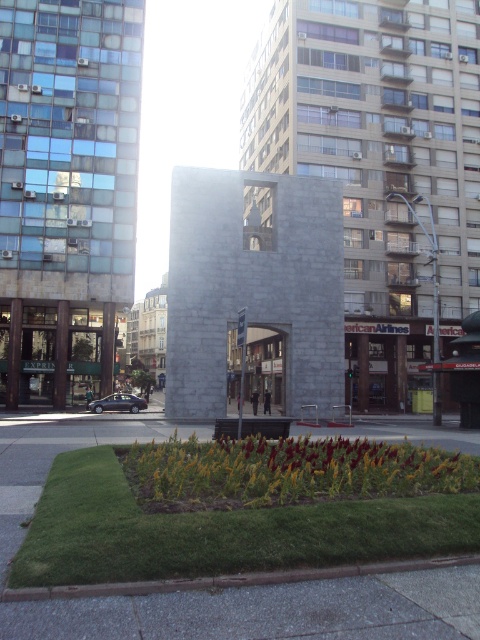
Is green grass at lower center wider than vibrant yellow-green foliage at center?

No, green grass at lower center is not wider than vibrant yellow-green foliage at center.

Is green grass at lower center closer to the viewer compared to vibrant yellow-green foliage at center?

Yes, it is.

Between point (92, 564) and point (162, 444), which one is positioned behind?

The point (162, 444) is behind.

You are a GUI agent. You are given a task and a screenshot of the screen. Output one action in this format:
    pyautogui.click(x=<x>, y=<y>)
    Task: Click on the green grass at lower center
    The width and height of the screenshot is (480, 640).
    Given the screenshot: What is the action you would take?
    pyautogui.click(x=244, y=508)

Is gray concrete pavement at lower center positioned before vibrant yellow-green foliage at center?

Yes, it is.

The width and height of the screenshot is (480, 640). What are the coordinates of `gray concrete pavement at lower center` in the screenshot? It's located at (264, 609).

Is point (252, 602) farther from camera compared to point (296, 438)?

No, it is not.

This screenshot has width=480, height=640. Identify the location of gray concrete pavement at lower center. (264, 609).

Who is more forward, (186, 492) or (159, 625)?

Point (159, 625) is in front.

Between green grass at lower center and gray concrete pavement at lower center, which one is positioned higher?

Positioned higher is gray concrete pavement at lower center.

Who is more distant from viewer, (x=216, y=484) or (x=60, y=636)?

The point (x=216, y=484) is more distant.

Identify the location of green grass at lower center. The image size is (480, 640). (244, 508).